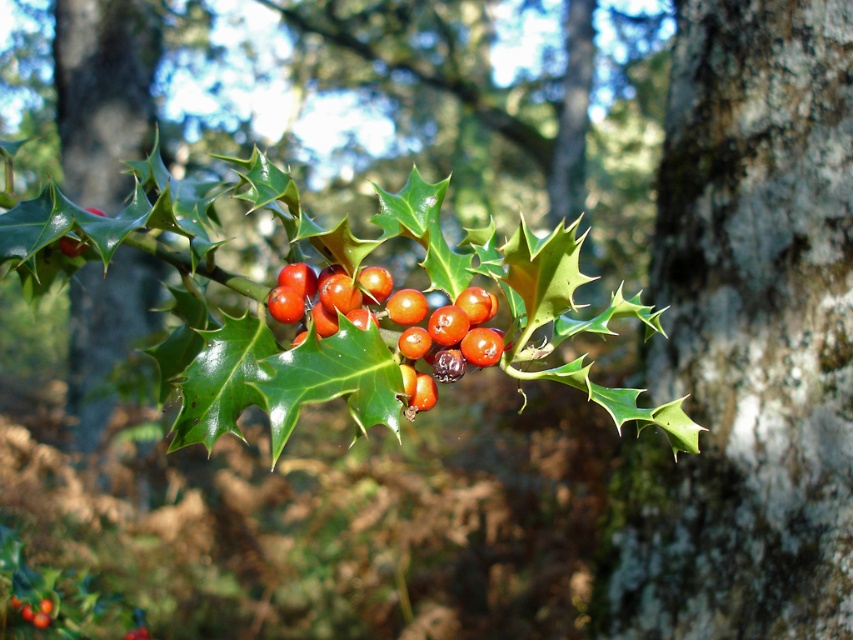
You are a photographer standing in front of a smooth bark tree trunk at left. You want to take a photo of it from a distance that is exactly 20 feet away. Can you do that?

The smooth bark tree trunk at left is 20.24 feet away from camera, so you can position yourself approximately 20 feet away to capture it, as the distance is very close to the desired 20 feet.

From the picture: You are a photographer trying to capture a detailed shot of the holly branch. You notice two points marked on your viewfinder at coordinates point (733, 76) and point (334, 296). Which point should you focus on first to ensure the closest part of the branch is sharp?

You should focus on point (733, 76) first because it is closer to the camera than point (334, 296), making it the closest part of the branch.

You are an artist sketching the holly branch and need to decide where to place your next stroke. Given the smooth bark tree trunk at left and the glossy red berries at center, which object should you draw first to maintain the correct spatial relationship?

The smooth bark tree trunk at left should be drawn first because it is positioned over the glossy red berries at center, meaning it appears in front spatially.